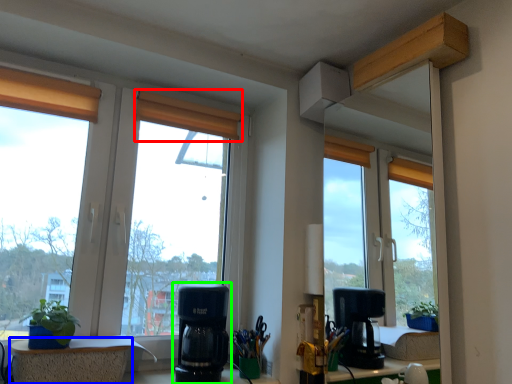
Question: Which object is the farthest from curtain (highlighted by a red box)? Choose among these: window (highlighted by a blue box) or coffee maker (highlighted by a green box).

Choices:
 (A) window
 (B) coffee maker

Answer: (A)